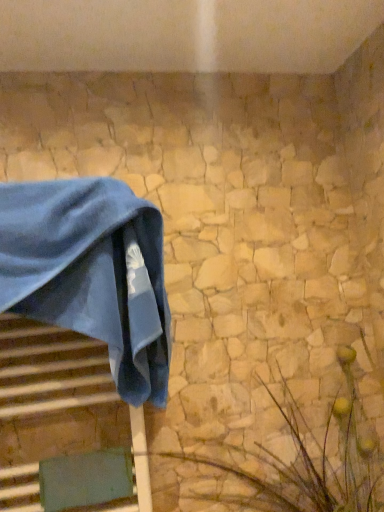
Image resolution: width=384 pixels, height=512 pixels. What do you see at coordinates (91, 273) in the screenshot?
I see `blue velvet towel at left` at bounding box center [91, 273].

Based on the photo, what is the approximate width of blue velvet towel at left?

blue velvet towel at left is 21.06 centimeters in width.

The height and width of the screenshot is (512, 384). In order to click on blue velvet towel at left in this screenshot , I will do `click(91, 273)`.

Looking at this image, measure the distance between point (122, 330) and camera.

32.32 inches.

Where is `green textured plant at lower right`? The width and height of the screenshot is (384, 512). green textured plant at lower right is located at coordinates (306, 461).

Describe the element at coordinates (306, 461) in the screenshot. This screenshot has height=512, width=384. I see `green textured plant at lower right` at that location.

What are the coordinates of `blue velvet towel at left` in the screenshot? It's located at (91, 273).

Which object is positioned more to the left, green textured plant at lower right or blue velvet towel at left?

Positioned to the left is blue velvet towel at left.

Is green textured plant at lower right behind blue velvet towel at left?

No, the depth of green textured plant at lower right is less than that of blue velvet towel at left.

Is point (352, 424) farther from viewer compared to point (83, 245)?

Yes, it is behind point (83, 245).

From the image's perspective, is green textured plant at lower right located above or below blue velvet towel at left?

green textured plant at lower right is below blue velvet towel at left.

From a real-world perspective, which object stands above the other?

blue velvet towel at left is physically above.

Considering the relative sizes of green textured plant at lower right and blue velvet towel at left in the image provided, is green textured plant at lower right wider than blue velvet towel at left?

Correct, the width of green textured plant at lower right exceeds that of blue velvet towel at left.

Can you confirm if green textured plant at lower right is shorter than blue velvet towel at left?

Correct, green textured plant at lower right is not as tall as blue velvet towel at left.

Is green textured plant at lower right bigger than blue velvet towel at left?

Indeed, green textured plant at lower right has a larger size compared to blue velvet towel at left.

Could blue velvet towel at left be considered to be inside green textured plant at lower right?

No, blue velvet towel at left is located outside of green textured plant at lower right.

Are green textured plant at lower right and blue velvet towel at left located far from each other?

Actually, green textured plant at lower right and blue velvet towel at left are a little close together.

Is green textured plant at lower right turned away from blue velvet towel at left?

No.

Based on the photo, how different are the orientations of green textured plant at lower right and blue velvet towel at left in degrees?

The angle between the facing direction of green textured plant at lower right and the facing direction of blue velvet towel at left is 89.5 degrees.

This screenshot has height=512, width=384. I want to click on towel lying above the green textured plant at lower right (from the image's perspective), so click(91, 273).

Does blue velvet towel at left appear on the right side of green textured plant at lower right?

In fact, blue velvet towel at left is to the left of green textured plant at lower right.

Is blue velvet towel at left positioned before green textured plant at lower right?

No, blue velvet towel at left is further to the viewer.

Does point (72, 307) come in front of point (294, 439)?

Yes, point (72, 307) is closer to viewer.

From the image's perspective, is blue velvet towel at left on top of green textured plant at lower right?

Indeed, from the image's perspective, blue velvet towel at left is shown above green textured plant at lower right.

From a real-world perspective, is blue velvet towel at left on top of green textured plant at lower right?

Yes, from a real-world perspective, blue velvet towel at left is above green textured plant at lower right.

Considering the sizes of blue velvet towel at left and green textured plant at lower right in the image, is blue velvet towel at left wider or thinner than green textured plant at lower right?

Considering their sizes, blue velvet towel at left looks slimmer than green textured plant at lower right.

Who is shorter, blue velvet towel at left or green textured plant at lower right?

green textured plant at lower right.

Considering the sizes of objects blue velvet towel at left and green textured plant at lower right in the image provided, who is smaller, blue velvet towel at left or green textured plant at lower right?

blue velvet towel at left.

Is blue velvet towel at left not inside green textured plant at lower right?

blue velvet towel at left is positioned outside green textured plant at lower right.

Can you see blue velvet towel at left touching green textured plant at lower right?

No, blue velvet towel at left is not with green textured plant at lower right.

Could you tell me if blue velvet towel at left is facing green textured plant at lower right?

No, blue velvet towel at left does not turn towards green textured plant at lower right.

Where is `plant lying in front of the blue velvet towel at left`? plant lying in front of the blue velvet towel at left is located at coordinates (306, 461).

In the image, there is a green textured plant at lower right. What are the coordinates of `towel above it (from the image's perspective)` in the screenshot? It's located at (91, 273).

Identify the location of plant that appears below the blue velvet towel at left (from the image's perspective). (306, 461).